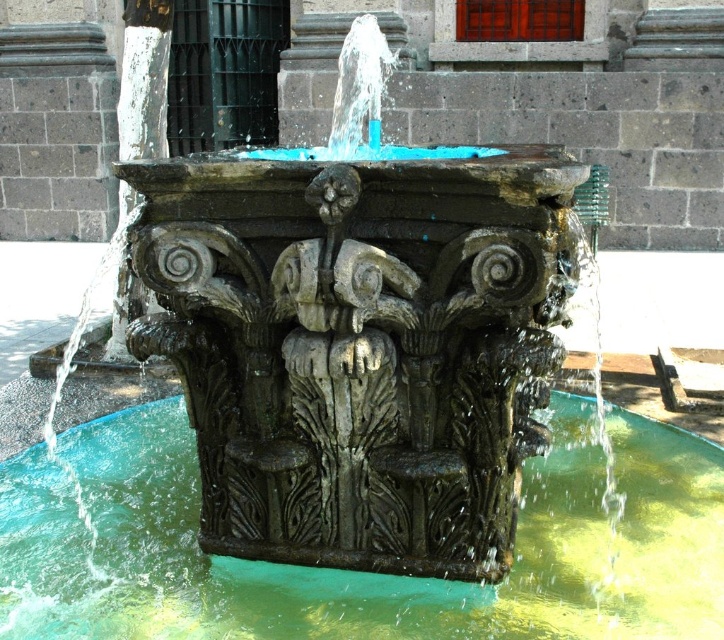
You are standing in front of the fountain and want to place a small statue between the two points, point [434,593] and point [324,243]. Which point should the statue be closer to in order to be closer to the viewer?

The statue should be closer to point [434,593] because it is closer to the viewer than point [324,243].

From the picture: You are standing in front of the fountain and want to place a small statue between the green polished water at center and the carved stone figure at center. If the statue is 12 inches wide, will there be enough space between them to fit it?

The distance between the green polished water at center and the carved stone figure at center is 27.31 inches. Since the statue is 12 inches wide, there is sufficient space to place it between them as 27.31 inches is greater than 12 inches.